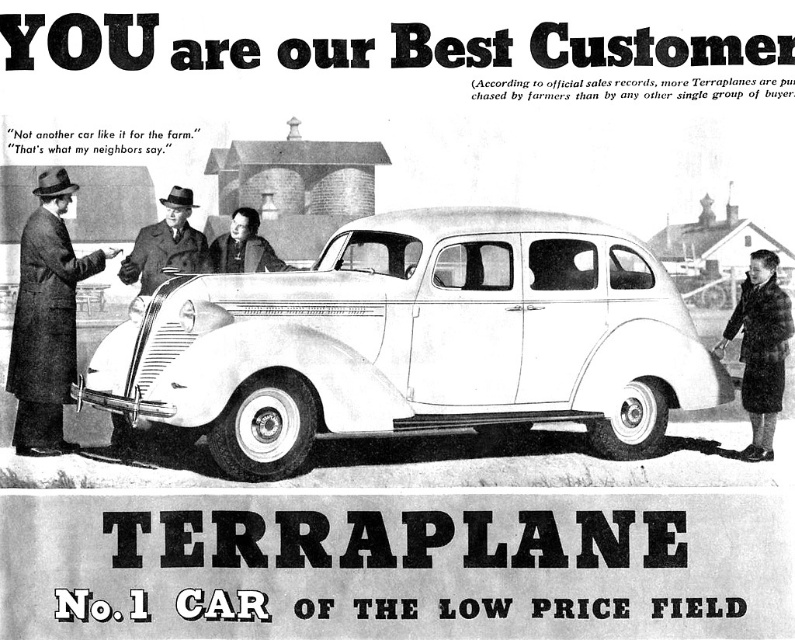
Based on the vintage Terraplane car advertisement, if you were to place the dark brown coat at left on the hood of the white matte sedan at center, would it cover the entire hood?

The white matte sedan at center might be wider than dark brown coat at left, so the coat might not cover the entire hood.

Based on the vintage Terraplane car advertisement scene, where is the white matte sedan at center in relation to the dark brown coat at left?

The white matte sedan at center is to the right of the dark brown coat at left.